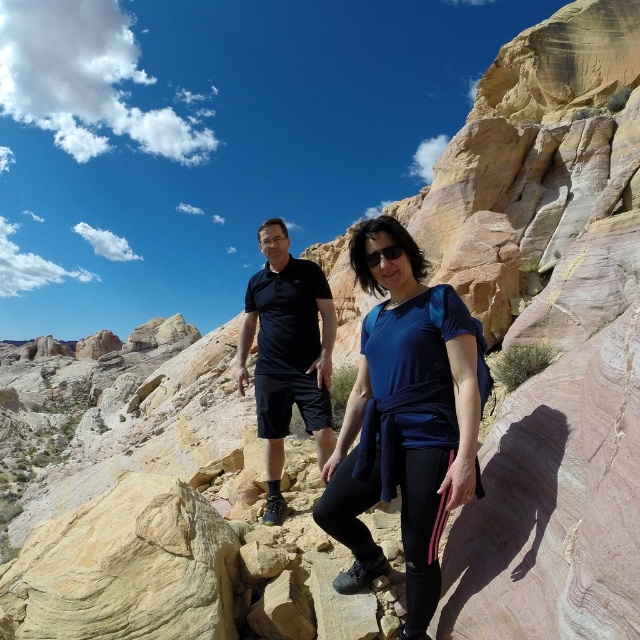
You are a photographer positioned at the front of the scene. You need to focus your camera on the closest object between the blue fabric shirt at center and the matte black polo shirt at center. Which one should you choose?

The blue fabric shirt at center is closer to the viewer than the matte black polo shirt at center, so you should focus on the blue fabric shirt at center.

You are a photographer trying to capture a group photo of the blue fabric shirt at center and the matte black polo shirt at center. Since you want to ensure both shirts are clearly visible, which one should you focus on first to avoid blurriness due to their sizes?

The blue fabric shirt at center has a lesser width compared to the matte black polo shirt at center, so you should focus on the blue fabric shirt at center first because smaller objects require more precise focusing to avoid blurriness.